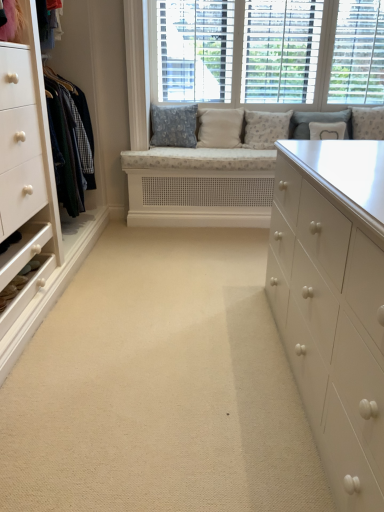
Question: Is white fabric pillow at upper center, the 5th pillow in the left-to-right sequence, positioned in front of beige carpet at center?

Choices:
 (A) no
 (B) yes

Answer: (A)

Question: Considering the relative sizes of white fabric pillow at upper center, the 5th pillow in the left-to-right sequence, and beige carpet at center in the image provided, is white fabric pillow at upper center, the 5th pillow in the left-to-right sequence, bigger than beige carpet at center?

Choices:
 (A) yes
 (B) no

Answer: (B)

Question: Is white fabric pillow at upper center, which ranks as the second pillow in right-to-left order, oriented towards beige carpet at center?

Choices:
 (A) no
 (B) yes

Answer: (A)

Question: From a real-world perspective, is white fabric pillow at upper center, which ranks as the second pillow in right-to-left order, on beige carpet at center?

Choices:
 (A) yes
 (B) no

Answer: (A)

Question: Is white fabric pillow at upper center, which ranks as the second pillow in right-to-left order, facing away from beige carpet at center?

Choices:
 (A) yes
 (B) no

Answer: (B)

Question: Would you consider white fabric pillow at upper center, which ranks as the second pillow in right-to-left order, to be distant from beige carpet at center?

Choices:
 (A) yes
 (B) no

Answer: (A)

Question: Is beige fabric pillow at center, which ranks as the second pillow in left-to-right order, facing away from white textured cushions at upper center?

Choices:
 (A) yes
 (B) no

Answer: (B)

Question: Considering the relative sizes of beige fabric pillow at center, which ranks as the second pillow in left-to-right order, and white textured cushions at upper center in the image provided, is beige fabric pillow at center, which ranks as the second pillow in left-to-right order, wider than white textured cushions at upper center?

Choices:
 (A) no
 (B) yes

Answer: (B)

Question: Is beige fabric pillow at center, which ranks as the second pillow in left-to-right order, located outside white textured cushions at upper center?

Choices:
 (A) yes
 (B) no

Answer: (A)

Question: Is the depth of beige fabric pillow at center, which ranks as the second pillow in left-to-right order, less than that of white textured cushions at upper center?

Choices:
 (A) yes
 (B) no

Answer: (B)

Question: Considering the relative positions of beige fabric pillow at center, which ranks as the second pillow in left-to-right order, and white textured cushions at upper center in the image provided, is beige fabric pillow at center, which ranks as the second pillow in left-to-right order, behind white textured cushions at upper center?

Choices:
 (A) no
 (B) yes

Answer: (B)

Question: Is beige fabric pillow at center, which ranks as the second pillow in left-to-right order, aimed at white textured cushions at upper center?

Choices:
 (A) no
 (B) yes

Answer: (A)

Question: Does white textured cushions at upper center have a greater height compared to patterned fabric pillow at center, the 4th pillow in the right-to-left sequence?

Choices:
 (A) yes
 (B) no

Answer: (A)